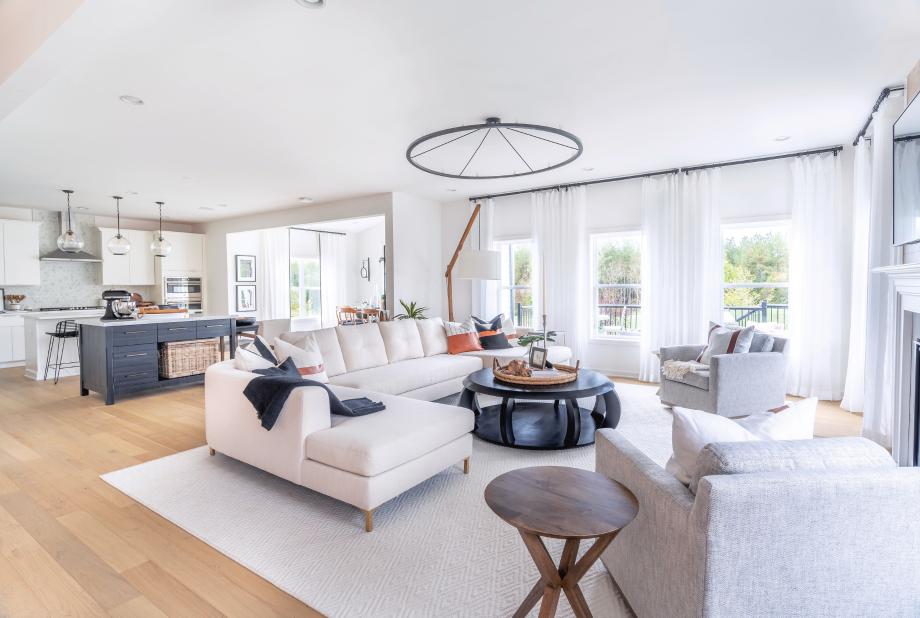
Identify the location of chair. (786, 531), (737, 360).